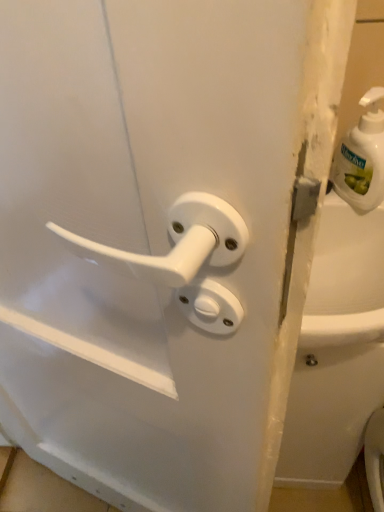
Question: From the image's perspective, is white plastic soap dispenser at upper right located beneath white glossy bathtub at right?

Choices:
 (A) no
 (B) yes

Answer: (A)

Question: Could you tell me if white plastic soap dispenser at upper right is turned towards white glossy bathtub at right?

Choices:
 (A) yes
 (B) no

Answer: (B)

Question: From a real-world perspective, is white plastic soap dispenser at upper right located higher than white glossy bathtub at right?

Choices:
 (A) no
 (B) yes

Answer: (B)

Question: Does white plastic soap dispenser at upper right appear on the right side of white glossy bathtub at right?

Choices:
 (A) yes
 (B) no

Answer: (B)

Question: Does white plastic soap dispenser at upper right touch white glossy bathtub at right?

Choices:
 (A) no
 (B) yes

Answer: (A)

Question: Does white plastic soap dispenser at upper right have a greater height compared to white glossy bathtub at right?

Choices:
 (A) no
 (B) yes

Answer: (A)

Question: From the image's perspective, is white glossy bathtub at right on top of white plastic soap dispenser at upper right?

Choices:
 (A) yes
 (B) no

Answer: (B)

Question: Is white glossy bathtub at right in front of white plastic soap dispenser at upper right?

Choices:
 (A) no
 (B) yes

Answer: (A)

Question: Can you confirm if white glossy bathtub at right is positioned to the left of white plastic soap dispenser at upper right?

Choices:
 (A) yes
 (B) no

Answer: (B)

Question: Is white glossy bathtub at right surrounding white plastic soap dispenser at upper right?

Choices:
 (A) no
 (B) yes

Answer: (A)

Question: Can you confirm if white glossy bathtub at right is bigger than white plastic soap dispenser at upper right?

Choices:
 (A) yes
 (B) no

Answer: (A)

Question: Considering the relative sizes of white glossy bathtub at right and white plastic soap dispenser at upper right in the image provided, is white glossy bathtub at right shorter than white plastic soap dispenser at upper right?

Choices:
 (A) no
 (B) yes

Answer: (A)

Question: Is white glossy bathtub at right to the left or to the right of white plastic soap dispenser at upper right in the image?

Choices:
 (A) left
 (B) right

Answer: (B)